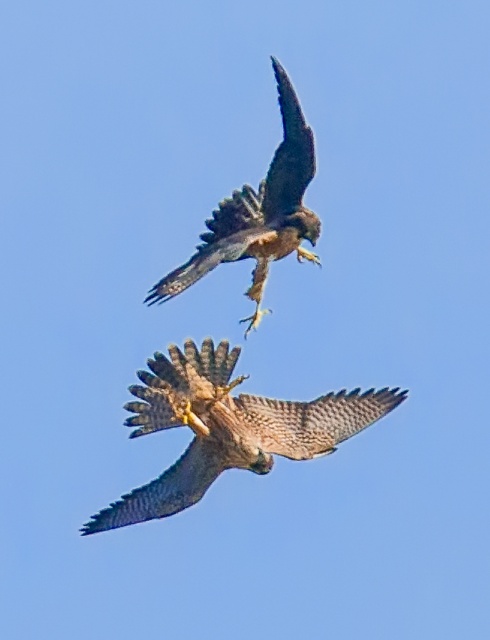
Is brown speckled feathers at center positioned in front of brown feathered eagle at upper center?

No, brown speckled feathers at center is further to the viewer.

Which of these two, brown speckled feathers at center or brown feathered eagle at upper center, stands shorter?

Standing shorter between the two is brown speckled feathers at center.

At what (x,y) coordinates should I click in order to perform the action: click on brown speckled feathers at center. Please return your answer as a coordinate pair (x, y). Looking at the image, I should click on (226, 428).